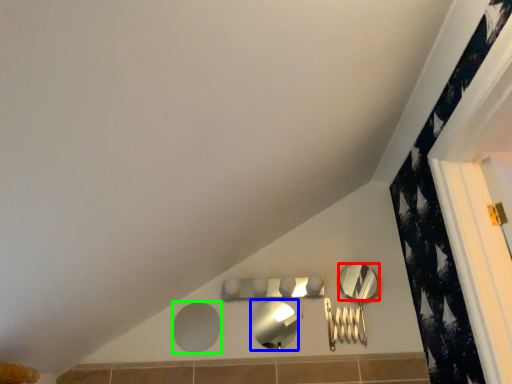
Question: Based on their relative distances, which object is nearer to mirror (highlighted by a red box)? Choose from mirror (highlighted by a blue box) and mirror (highlighted by a green box).

Choices:
 (A) mirror
 (B) mirror

Answer: (A)